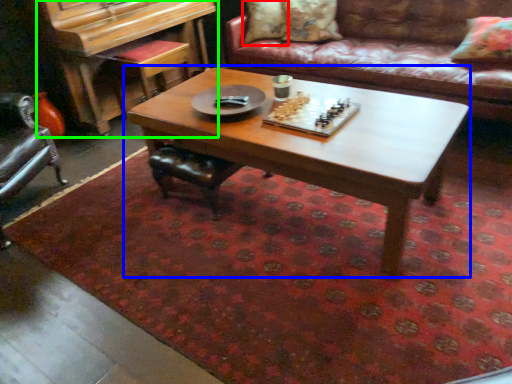
Question: Considering the real-world distances, which object is farthest from pillow (highlighted by a red box)? coffee table (highlighted by a blue box) or piano (highlighted by a green box)?

Choices:
 (A) coffee table
 (B) piano

Answer: (A)